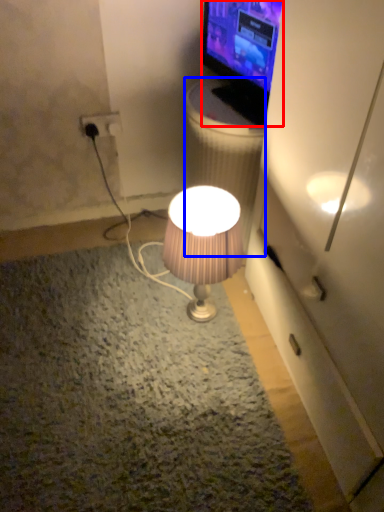
Question: Which object is closer to the camera taking this photo, television (highlighted by a red box) or trash bin/can (highlighted by a blue box)?

Choices:
 (A) television
 (B) trash bin/can

Answer: (A)